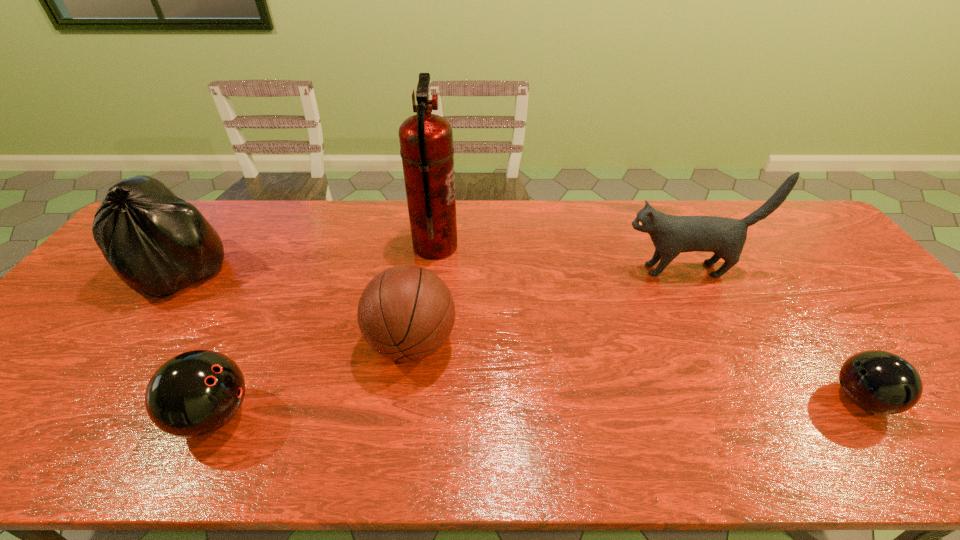
Identify the location of empty space between the fourth tallest object and the cat. This screenshot has height=540, width=960. (548, 307).

Identify the location of empty location between the basketball and the cat. Image resolution: width=960 pixels, height=540 pixels. (548, 307).

Identify the location of free space between the fifth object from right to left and the cat. The image size is (960, 540). [449, 342].

I want to click on empty space between the fire extinguisher and the leftmost object, so click(x=308, y=259).

I want to click on vacant space that's between the fourth tallest object and the shorter bowling ball, so click(636, 372).

Locate an element on the screen. Image resolution: width=960 pixels, height=540 pixels. vacant region between the plastic bag and the left bowling ball is located at coordinates pyautogui.click(x=198, y=343).

Identify which object is the fourth nearest to the shortest object. Please provide its 2D coordinates. Your answer should be formatted as a tuple, i.e. [(x, y)], where the tuple contains the x and y coordinates of a point satisfying the conditions above.

[(195, 393)]

Choose which object is the fourth nearest neighbor to the cat. Please provide its 2D coordinates. Your answer should be formatted as a tuple, i.e. [(x, y)], where the tuple contains the x and y coordinates of a point satisfying the conditions above.

[(195, 393)]